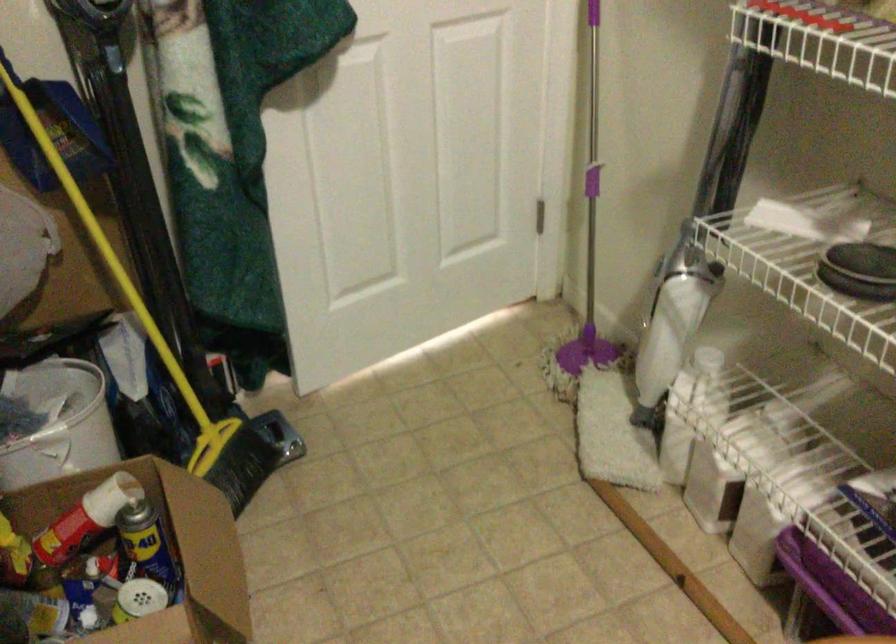
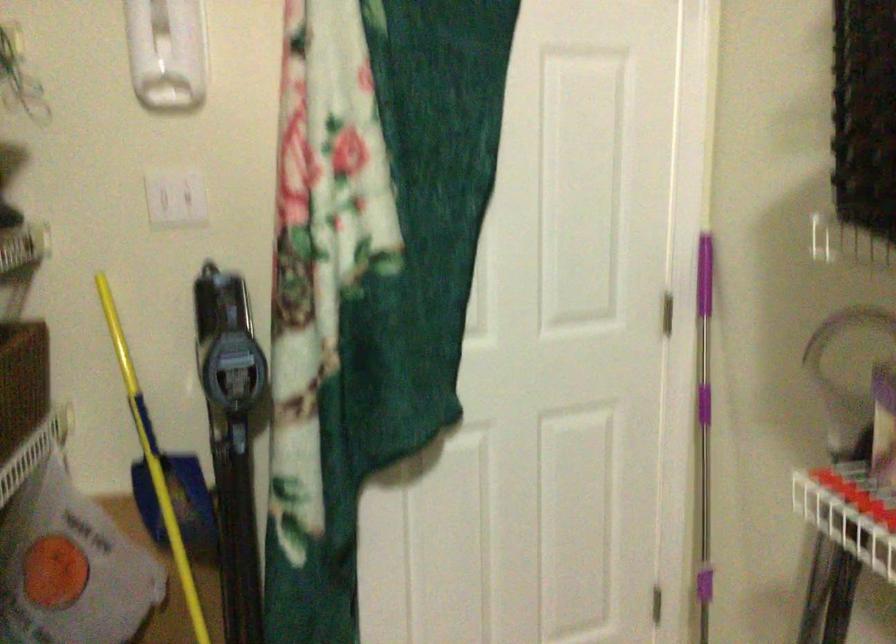
Question: The images are taken continuously from a first-person perspective. In which direction are you moving?

Choices:
 (A) Left
 (B) Right
 (C) Forward
 (D) Backward

Answer: (B)